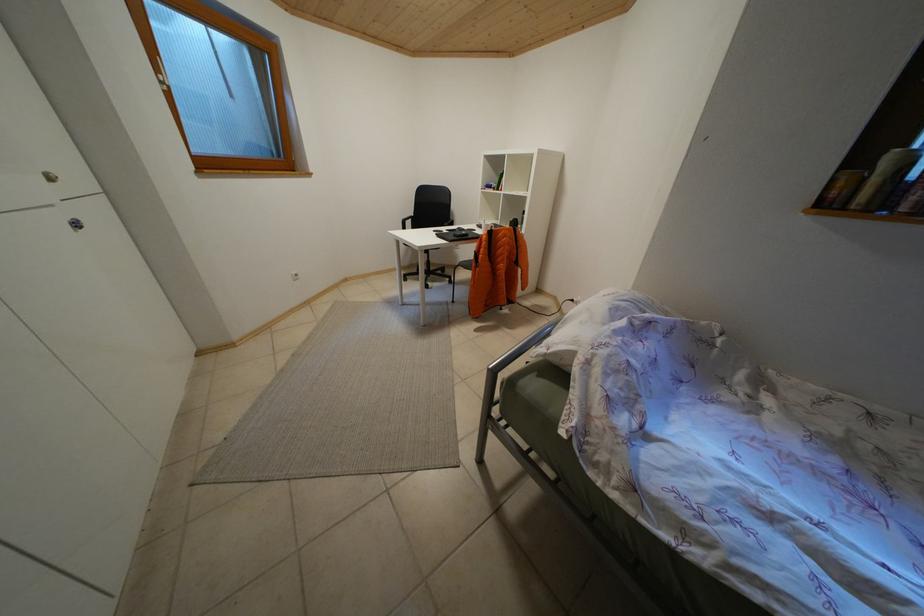
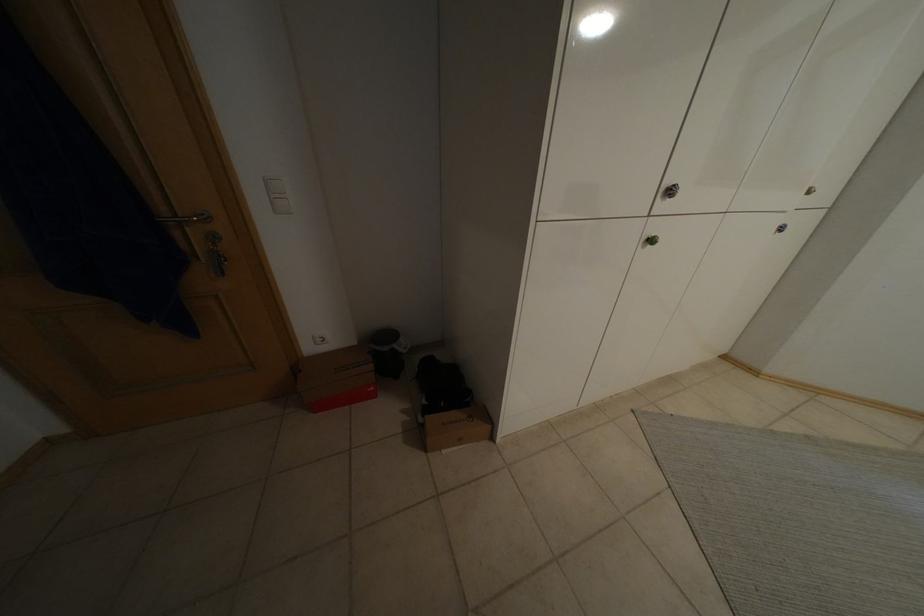
Based on the continuous images, in which direction is the camera rotating?

The camera's rotation is toward left-down.